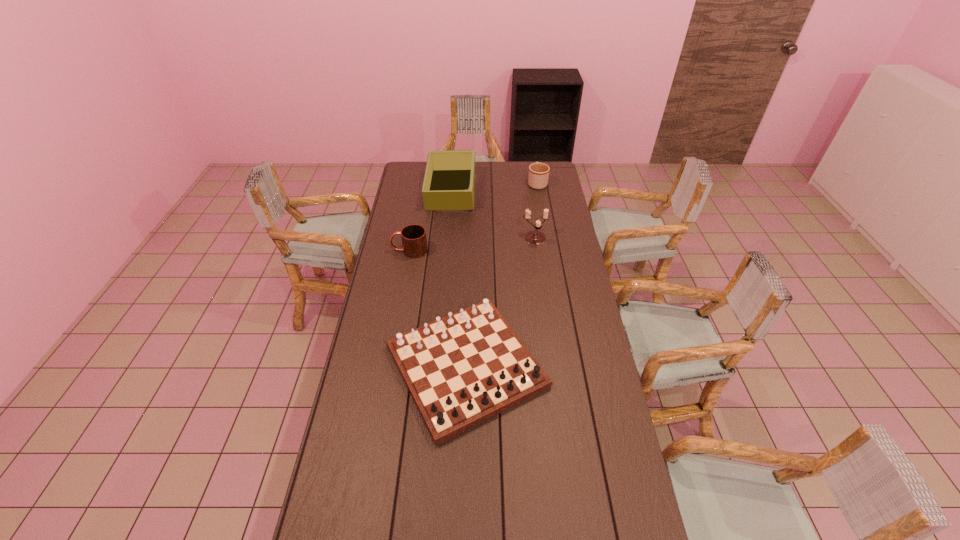
You are a GUI agent. You are given a task and a screenshot of the screen. Output one action in this format:
    pyautogui.click(x=<x>, y=<y>)
    Task: Click on the box
    The width and height of the screenshot is (960, 540).
    Given the screenshot: What is the action you would take?
    [x=449, y=183]

Identify the location of candle holder. Image resolution: width=960 pixels, height=540 pixels. (535, 237).

Where is `the right mug`? This screenshot has width=960, height=540. the right mug is located at coordinates (538, 176).

In order to click on the nearer mug in this screenshot , I will do `click(414, 242)`.

Identify the location of chessboard. This screenshot has width=960, height=540. (462, 369).

The height and width of the screenshot is (540, 960). Find the location of `free space located 0.120m on the left of the box`. free space located 0.120m on the left of the box is located at coordinates (405, 191).

At what (x,y) coordinates should I click in order to perform the action: click on vacant space situated 0.210m on the left of the candle holder. Please return your answer as a coordinate pair (x, y). This screenshot has width=960, height=540. Looking at the image, I should click on (479, 239).

At what (x,y) coordinates should I click in order to perform the action: click on free spot located on the side of the right mug with the handle. Please return your answer as a coordinate pair (x, y). Looking at the image, I should click on (534, 163).

At what (x,y) coordinates should I click in order to perform the action: click on vacant space located on the back of the nearest object. Please return your answer as a coordinate pair (x, y). The width and height of the screenshot is (960, 540). Looking at the image, I should click on (469, 257).

This screenshot has height=540, width=960. Identify the location of box situated at the far edge. (449, 183).